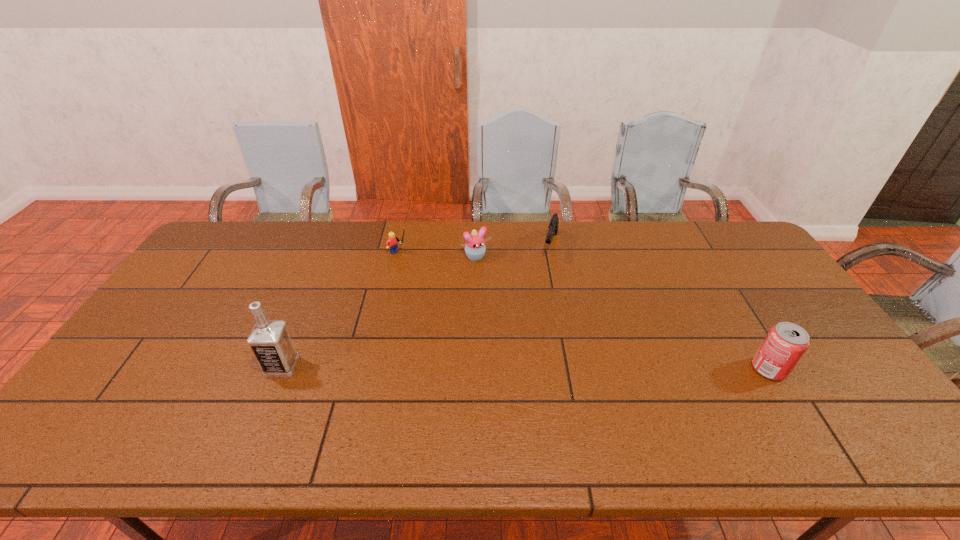
The height and width of the screenshot is (540, 960). I want to click on the leftmost object, so click(269, 339).

Identify the location of vodka. The width and height of the screenshot is (960, 540). (269, 339).

Find the location of a particular element. the second tallest object is located at coordinates (785, 343).

Image resolution: width=960 pixels, height=540 pixels. In order to click on the rightmost object in this screenshot , I will do `click(785, 343)`.

At what (x,y) coordinates should I click in order to perform the action: click on the second object from right to left. Please return your answer as a coordinate pair (x, y). Looking at the image, I should click on (553, 225).

Find the location of a particular element. the fourth object from right to left is located at coordinates (391, 243).

Image resolution: width=960 pixels, height=540 pixels. In order to click on cupcake in this screenshot , I will do (475, 248).

The width and height of the screenshot is (960, 540). In order to click on free space located on the front label of the vodka in this screenshot , I will do [242, 366].

You are a GUI agent. You are given a task and a screenshot of the screen. Output one action in this format:
    pyautogui.click(x=<x>, y=<y>)
    Task: Click on the blank area located on the front label of the vodka
    Image resolution: width=960 pixels, height=540 pixels.
    Given the screenshot: What is the action you would take?
    pyautogui.click(x=124, y=366)

Image resolution: width=960 pixels, height=540 pixels. In order to click on blank area located on the front label of the vodka in this screenshot , I will do `click(192, 366)`.